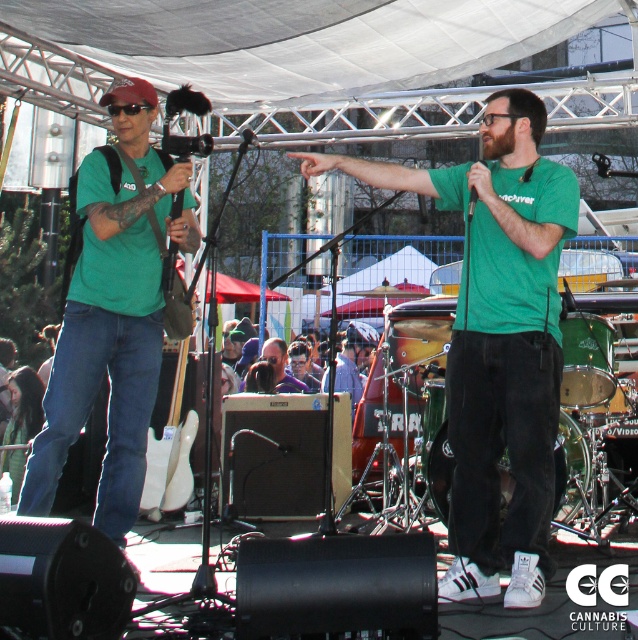
How far apart are green matte t-shirt at center and matte green t-shirt at left?

green matte t-shirt at center and matte green t-shirt at left are 5.37 feet apart from each other.

Is green matte t-shirt at center taller than matte green t-shirt at left?

Indeed, green matte t-shirt at center has a greater height compared to matte green t-shirt at left.

This screenshot has width=638, height=640. I want to click on green matte t-shirt at center, so click(498, 340).